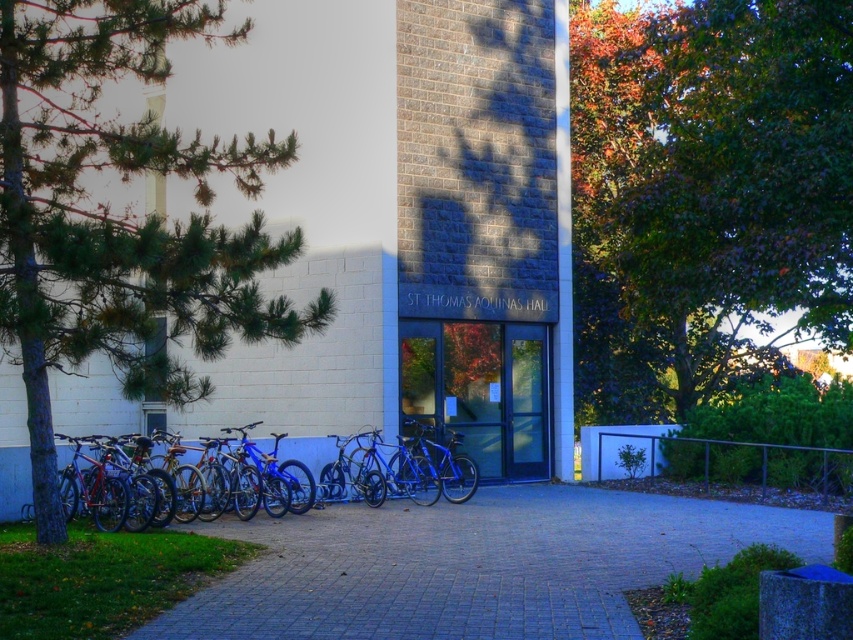
Question: Estimate the real-world distances between objects in this image. Which object is farther from the blue metallic bicycle at center?

Choices:
 (A) green needle-like leaves at left
 (B) gray concrete pavement at center
 (C) green leafy tree at upper right
 (D) blue matte bicycle at center

Answer: (C)

Question: Among these points, which one is nearest to the camera?

Choices:
 (A) (283, 477)
 (B) (566, 500)
 (C) (363, 481)
 (D) (741, 176)

Answer: (D)

Question: Considering the relative positions of blue metallic bicycle at center and blue matte bicycle at center in the image provided, where is blue metallic bicycle at center located with respect to blue matte bicycle at center?

Choices:
 (A) left
 (B) right

Answer: (B)

Question: Where is gray concrete pavement at center located in relation to blue matte bicycle at center in the image?

Choices:
 (A) below
 (B) above

Answer: (A)

Question: Is blue metallic bicycle at center bigger than blue matte bicycle at center?

Choices:
 (A) no
 (B) yes

Answer: (B)

Question: Which object is closer to the camera taking this photo?

Choices:
 (A) green leafy tree at upper right
 (B) green needle-like leaves at left
 (C) blue metallic bicycle at center

Answer: (A)